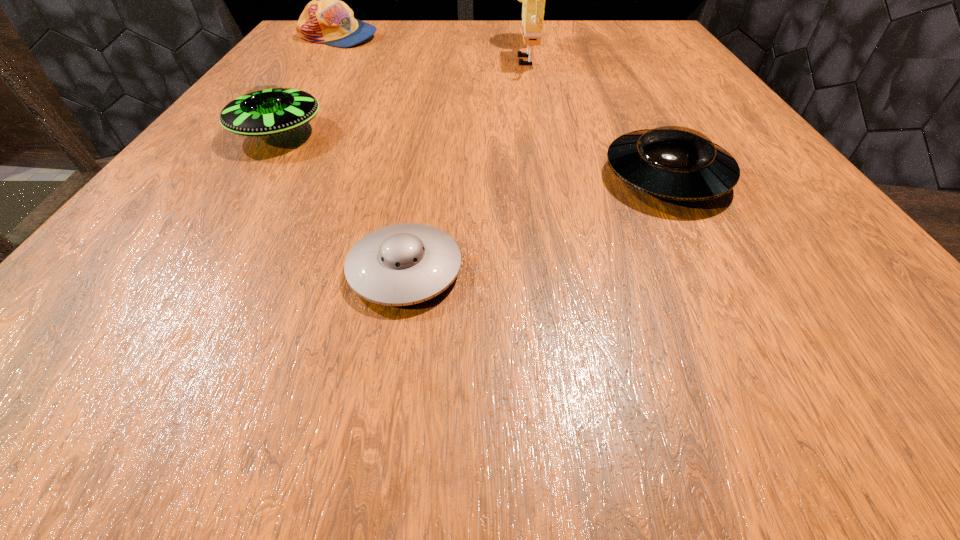
At what (x,y) coordinates should I click in order to perform the action: click on free space in the image that satisfies the following two spatial constraints: 1. on the bill of the cap; 2. on the back side of the second saucer from left to right. Please return your answer as a coordinate pair (x, y). Image resolution: width=960 pixels, height=540 pixels. Looking at the image, I should click on (185, 270).

The height and width of the screenshot is (540, 960). Identify the location of vacant space that satisfies the following two spatial constraints: 1. on the front side of the tallest saucer; 2. on the left side of the second saucer from left to right. (190, 270).

Identify the location of vacant space that satisfies the following two spatial constraints: 1. on the back side of the leftmost saucer; 2. on the bill of the cap. (340, 37).

This screenshot has width=960, height=540. Identify the location of vacant space that satisfies the following two spatial constraints: 1. on the front-facing side of the tallest object; 2. on the front side of the tallest saucer. (543, 133).

Find the location of a particular element. free spot that satisfies the following two spatial constraints: 1. on the front-facing side of the rightmost saucer; 2. on the left side of the sponge is located at coordinates (552, 177).

In order to click on vacant space that satisfies the following two spatial constraints: 1. on the bill of the cap; 2. on the left side of the second saucer from left to right in this screenshot , I will do `click(185, 270)`.

Image resolution: width=960 pixels, height=540 pixels. What are the coordinates of `vacant area that satisfies the following two spatial constraints: 1. on the front side of the rightmost saucer; 2. on the left side of the tallest saucer` in the screenshot? It's located at (250, 177).

The image size is (960, 540). I want to click on free space that satisfies the following two spatial constraints: 1. on the bill of the rightmost object; 2. on the right side of the cap, so click(x=246, y=177).

You are a GUI agent. You are given a task and a screenshot of the screen. Output one action in this format:
    pyautogui.click(x=<x>, y=<y>)
    Task: Click on the free location that satisfies the following two spatial constraints: 1. on the back side of the second tallest saucer; 2. on the front-facing side of the second object from right to left
    The image size is (960, 540).
    Given the screenshot: What is the action you would take?
    pyautogui.click(x=602, y=54)

The width and height of the screenshot is (960, 540). What are the coordinates of `vacant position in the image that satisfies the following two spatial constraints: 1. on the back side of the leftmost saucer; 2. on the bill of the cap` in the screenshot? It's located at (340, 37).